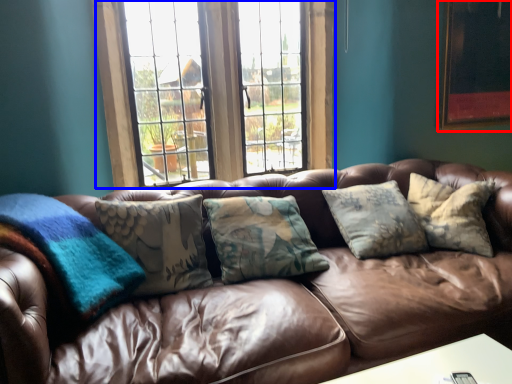
Question: Which object is further to the camera taking this photo, picture frame (highlighted by a red box) or window (highlighted by a blue box)?

Choices:
 (A) picture frame
 (B) window

Answer: (A)